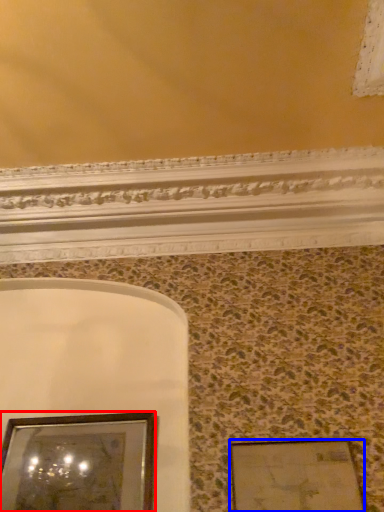
Question: Which object appears closest to the camera in this image, picture frame (highlighted by a red box) or picture frame (highlighted by a blue box)?

Choices:
 (A) picture frame
 (B) picture frame

Answer: (B)